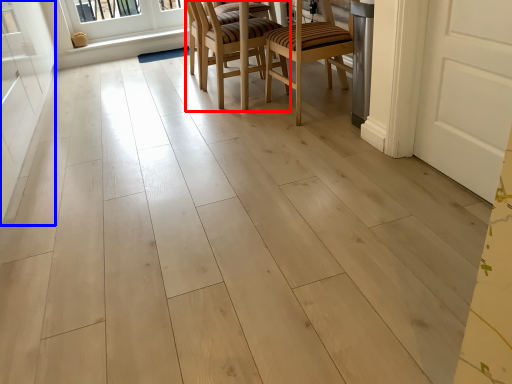
Question: Among these objects, which one is nearest to the camera, chair (highlighted by a red box) or screen door (highlighted by a blue box)?

Choices:
 (A) chair
 (B) screen door

Answer: (B)